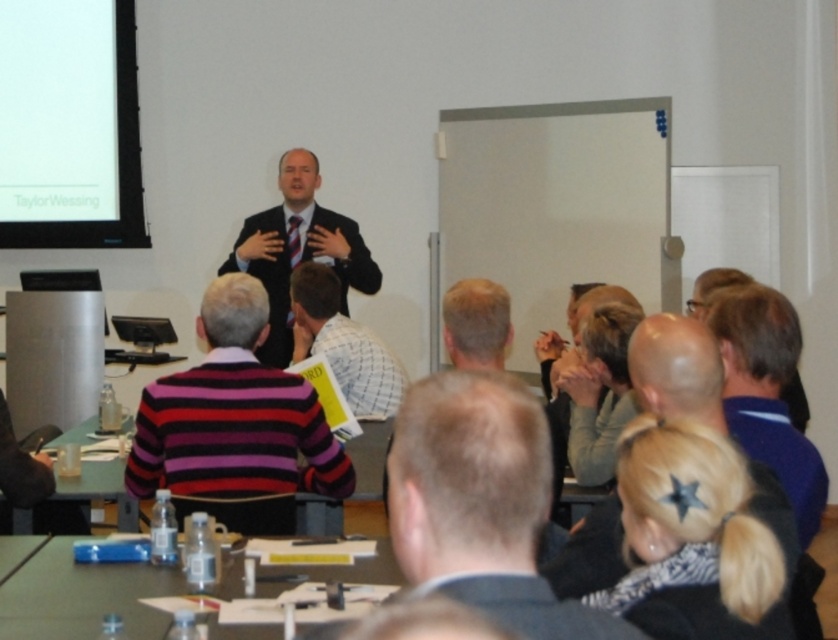
You are a photographer in the back of the room. You want to take a photo of the light brown hair at center and the clear plastic table at lower left. Which object should you focus on first if you want to capture both in one shot?

The light brown hair at center is above the clear plastic table at lower left, so you should focus on the light brown hair at center first to ensure both are in focus.